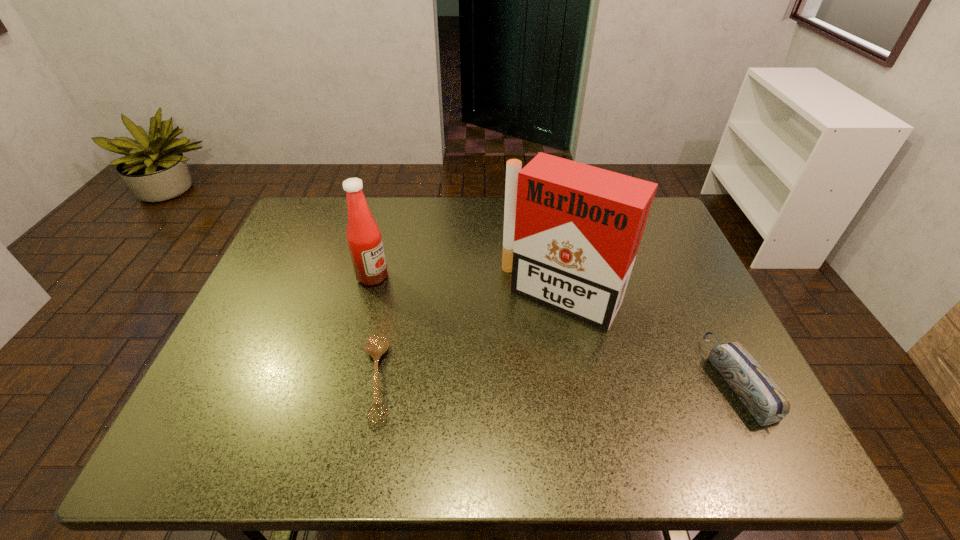
In the image, there is a desktop. Identify the location of vacant area at the left edge. (275, 266).

You are a GUI agent. You are given a task and a screenshot of the screen. Output one action in this format:
    pyautogui.click(x=<x>, y=<y>)
    Task: Click on the free region at the right edge of the desktop
    This screenshot has height=540, width=960.
    Given the screenshot: What is the action you would take?
    pyautogui.click(x=646, y=253)

The height and width of the screenshot is (540, 960). I want to click on vacant space at the near left corner, so click(265, 397).

At what (x,y) coordinates should I click in order to perform the action: click on vacant region between the rightmost object and the cigarette case. Please return your answer as a coordinate pair (x, y). The width and height of the screenshot is (960, 540). Looking at the image, I should click on (650, 338).

The height and width of the screenshot is (540, 960). I want to click on vacant area that lies between the tallest object and the condiment, so click(x=467, y=286).

Identify the location of empty space between the shortest object and the tallest object. This screenshot has width=960, height=540. (469, 337).

This screenshot has height=540, width=960. What are the coordinates of `unoccupied area between the cigarette case and the shortest object` in the screenshot? It's located at (469, 337).

What are the coordinates of `free space between the ladle and the second tallest object` in the screenshot? It's located at (375, 328).

The image size is (960, 540). In order to click on empty space that is in between the second object from right to left and the shortest object in this screenshot , I will do `click(469, 337)`.

Image resolution: width=960 pixels, height=540 pixels. I want to click on free space between the condiment and the rightmost object, so pyautogui.click(x=555, y=328).